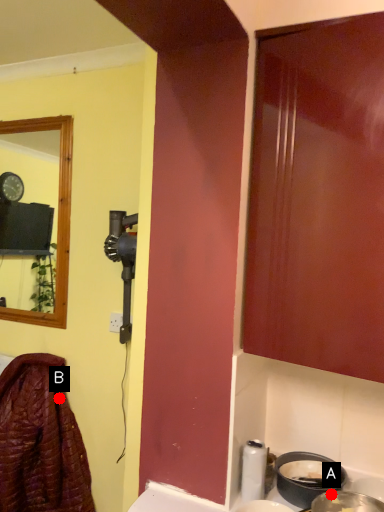
Question: Two points are circled on the image, labeled by A and B beside each circle. Which of the following is the closest to the observer?

Choices:
 (A) A is closer
 (B) B is closer

Answer: (A)